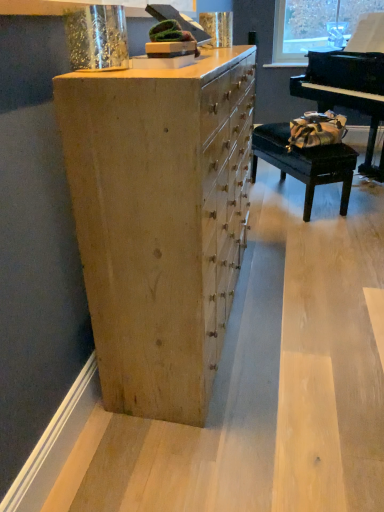
Question: Is black polished piano at right with black leather table at right?

Choices:
 (A) yes
 (B) no

Answer: (B)

Question: Does black polished piano at right have a smaller size compared to black leather table at right?

Choices:
 (A) no
 (B) yes

Answer: (A)

Question: From the image's perspective, is black polished piano at right located beneath black leather table at right?

Choices:
 (A) no
 (B) yes

Answer: (A)

Question: Is black polished piano at right positioned before black leather table at right?

Choices:
 (A) yes
 (B) no

Answer: (A)

Question: Is black polished piano at right surrounding black leather table at right?

Choices:
 (A) yes
 (B) no

Answer: (B)

Question: From a real-world perspective, does black polished piano at right stand above black leather table at right?

Choices:
 (A) no
 (B) yes

Answer: (B)

Question: From the image's perspective, would you say natural wood chest of drawers at center is positioned over black polished piano at right?

Choices:
 (A) no
 (B) yes

Answer: (A)

Question: Considering the relative positions of natural wood chest of drawers at center and black polished piano at right in the image provided, is natural wood chest of drawers at center to the right of black polished piano at right from the viewer's perspective?

Choices:
 (A) no
 (B) yes

Answer: (A)

Question: Does natural wood chest of drawers at center have a larger size compared to black polished piano at right?

Choices:
 (A) no
 (B) yes

Answer: (A)

Question: Is natural wood chest of drawers at center positioned in front of black polished piano at right?

Choices:
 (A) yes
 (B) no

Answer: (A)

Question: Does natural wood chest of drawers at center have a lesser height compared to black polished piano at right?

Choices:
 (A) yes
 (B) no

Answer: (A)

Question: Considering the relative sizes of natural wood chest of drawers at center and black polished piano at right in the image provided, is natural wood chest of drawers at center taller than black polished piano at right?

Choices:
 (A) yes
 (B) no

Answer: (B)

Question: Is black leather table at right to the right of black polished piano at right from the viewer's perspective?

Choices:
 (A) yes
 (B) no

Answer: (B)